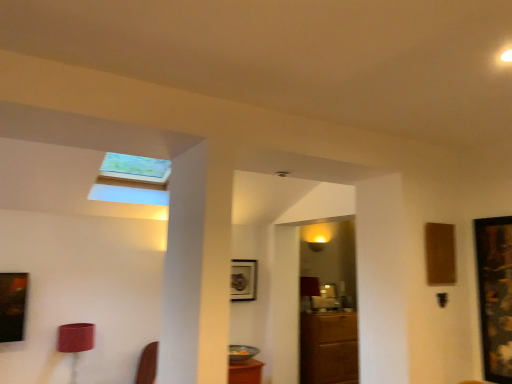
Question: In the image, is wooden framed artwork at right, acting as the 1th picture frame starting from the right, positioned in front of or behind brown wooden cabinet at center?

Choices:
 (A) front
 (B) behind

Answer: (A)

Question: Considering the positions of wooden framed artwork at right, the first picture frame when ordered from front to back, and brown wooden cabinet at center in the image, is wooden framed artwork at right, the first picture frame when ordered from front to back, taller or shorter than brown wooden cabinet at center?

Choices:
 (A) short
 (B) tall

Answer: (B)

Question: Estimate the real-world distances between objects in this image. Which object is closer to the metallic silver picture frame at center, which is counted as the 1th picture frame, starting from the back?

Choices:
 (A) wooden framed artwork at right, the 2th picture frame positioned from the left
 (B) brown wooden cabinet at center

Answer: (B)

Question: Considering the real-world distances, which object is farthest from the metallic silver picture frame at center, placed as the second picture frame when sorted from front to back?

Choices:
 (A) wooden framed artwork at right, the first picture frame when ordered from front to back
 (B) brown wooden cabinet at center

Answer: (A)